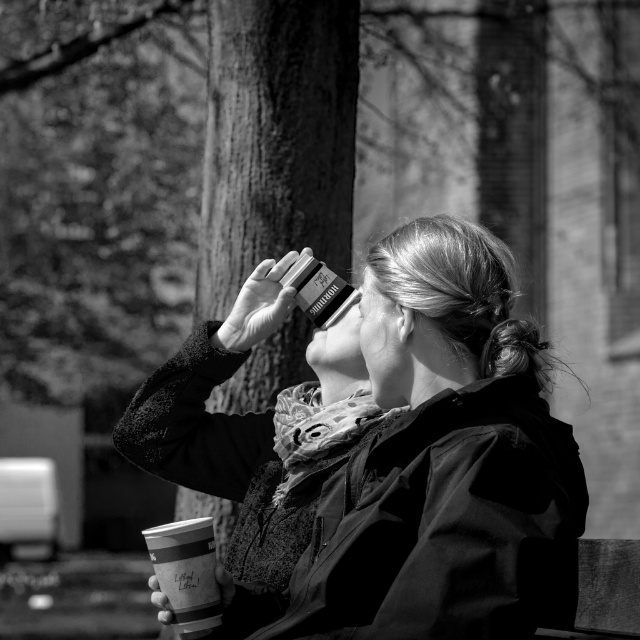
You are standing at a point where you want to take a photo of the matte black jacket at center. If you move 10 meters closer to the jacket, will you be within 5 meters of it?

The matte black jacket at center is initially 14.08 meters away. Moving 10 meters closer reduces the distance to 4.08 meters, which is within the 5 meters threshold. Yes, you will be within 5 meters of the matte black jacket at center.

Please use the coordinates provided to determine the exact location of the matte black jacket at center in the image. What are its coordinates?

The coordinates of the matte black jacket at center are at point (435, 464).

You are a photographer trying to focus on the matte black jacket at center and the smooth bark tree at center in this black and white photo. Which object should you adjust your camera to focus on first if you want to capture both clearly in the same frame?

The matte black jacket at center is closer to the viewer than the smooth bark tree at center, so you should focus on the matte black jacket at center first to ensure both are in focus.